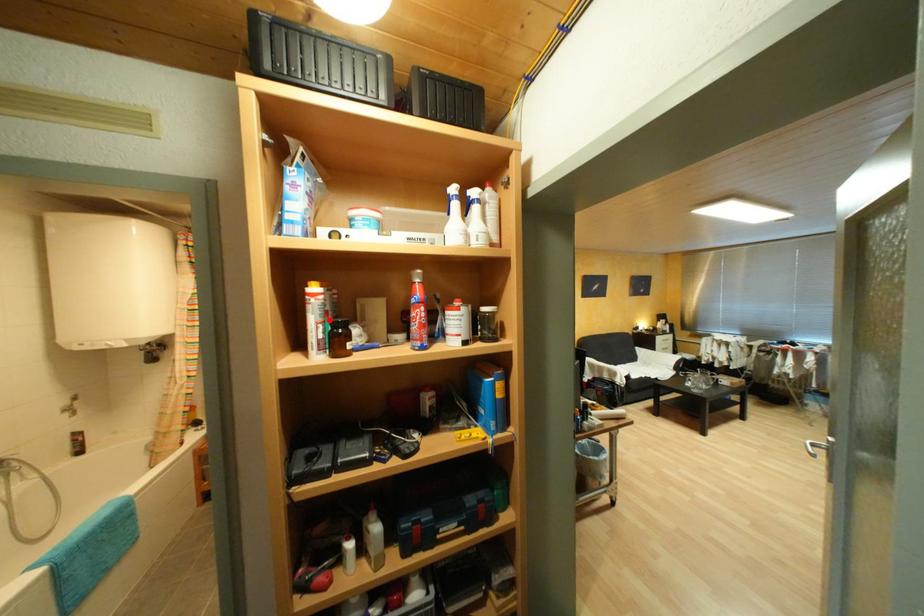
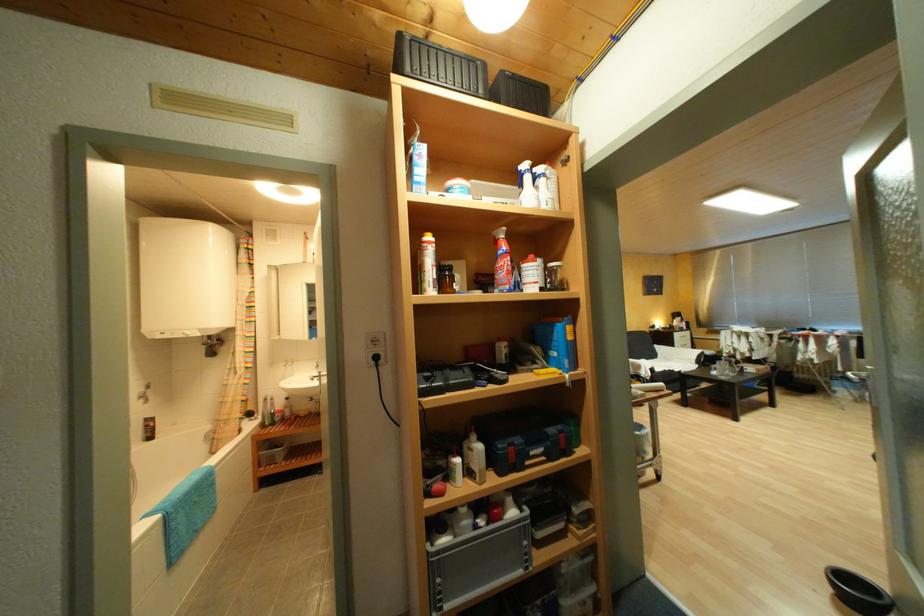
Find the pixel in the second image that matches the highlighted location in the first image.

(444, 264)